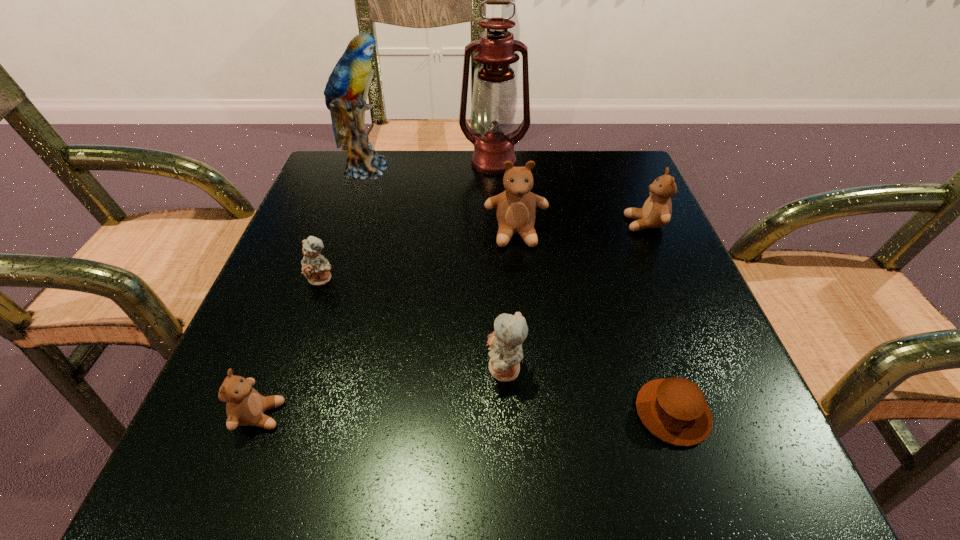
Where is `vacant space at the near left corner of the desktop`? This screenshot has height=540, width=960. vacant space at the near left corner of the desktop is located at coordinates (196, 487).

Where is `vacant area at the far right corner of the desktop`? vacant area at the far right corner of the desktop is located at coordinates (639, 207).

The image size is (960, 540). I want to click on free space at the near right corner of the desktop, so click(x=663, y=443).

You are a GUI agent. You are given a task and a screenshot of the screen. Output one action in this format:
    pyautogui.click(x=<x>, y=<y>)
    Task: Click on the free space that is in between the rightmost brown teddy bear and the oil lamp
    The image size is (960, 540).
    Given the screenshot: What is the action you would take?
    pyautogui.click(x=569, y=193)

Image resolution: width=960 pixels, height=540 pixels. In order to click on vacant space that's between the second smallest brown teddy bear and the oil lamp in this screenshot , I will do `click(569, 193)`.

Where is `empty location between the fourth nearest object and the third tallest object`? The height and width of the screenshot is (540, 960). empty location between the fourth nearest object and the third tallest object is located at coordinates (419, 256).

The width and height of the screenshot is (960, 540). What are the coordinates of `free space that is in between the tallest teddy bear and the parrot` in the screenshot? It's located at (441, 201).

Where is `unoccupied area between the rightmost brown teddy bear and the brown muffin`? The image size is (960, 540). unoccupied area between the rightmost brown teddy bear and the brown muffin is located at coordinates (659, 318).

Identify the location of vacant point located between the muffin and the tallest teddy bear. The image size is (960, 540). (594, 323).

In order to click on vacant region between the oil lamp and the third nearest teddy bear in this screenshot , I will do `click(408, 221)`.